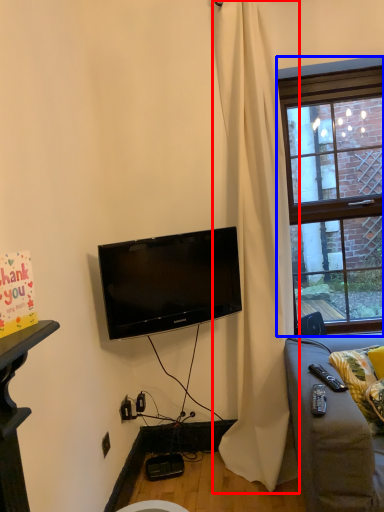
Question: Which point is further to the camera, curtain (highlighted by a red box) or window (highlighted by a blue box)?

Choices:
 (A) curtain
 (B) window

Answer: (B)